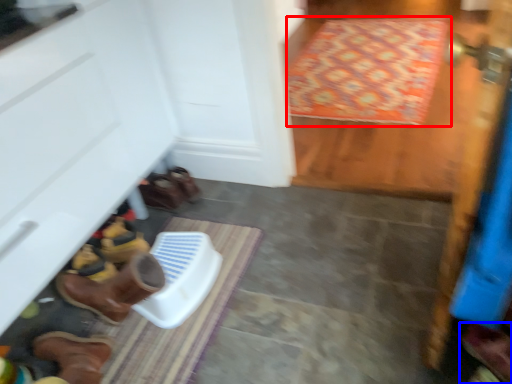
Question: Which of the following is the farthest to the observer, doormat (highlighted by a red box) or footwear (highlighted by a blue box)?

Choices:
 (A) doormat
 (B) footwear

Answer: (A)